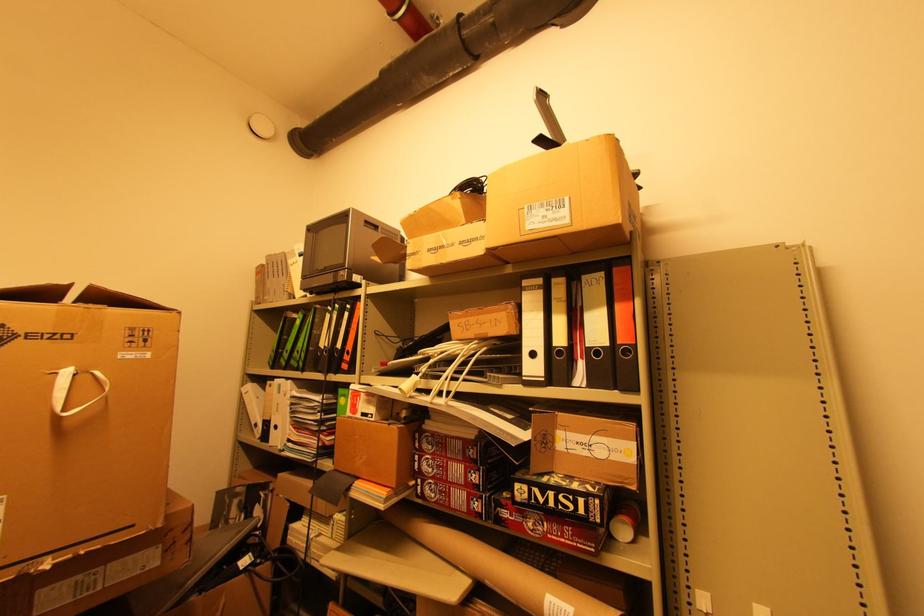
The width and height of the screenshot is (924, 616). Describe the element at coordinates (434, 66) in the screenshot. I see `the rolled cardboard tube` at that location.